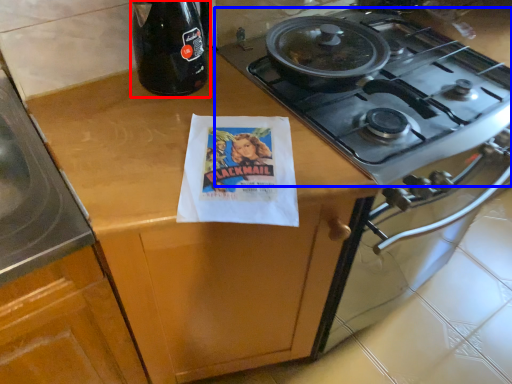
Question: Which object appears farthest to the camera in this image, bottle (highlighted by a red box) or gas stove (highlighted by a blue box)?

Choices:
 (A) bottle
 (B) gas stove

Answer: (A)